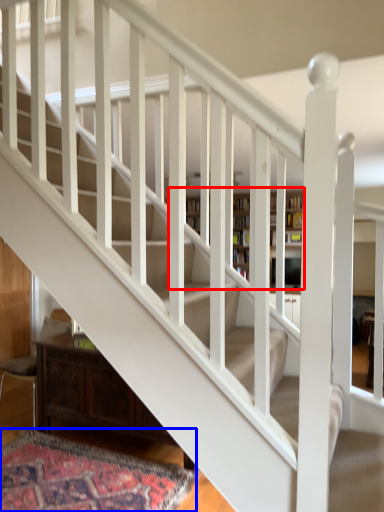
Question: Which object appears closest to the camera in this image, bookcase (highlighted by a red box) or mat (highlighted by a blue box)?

Choices:
 (A) bookcase
 (B) mat

Answer: (B)